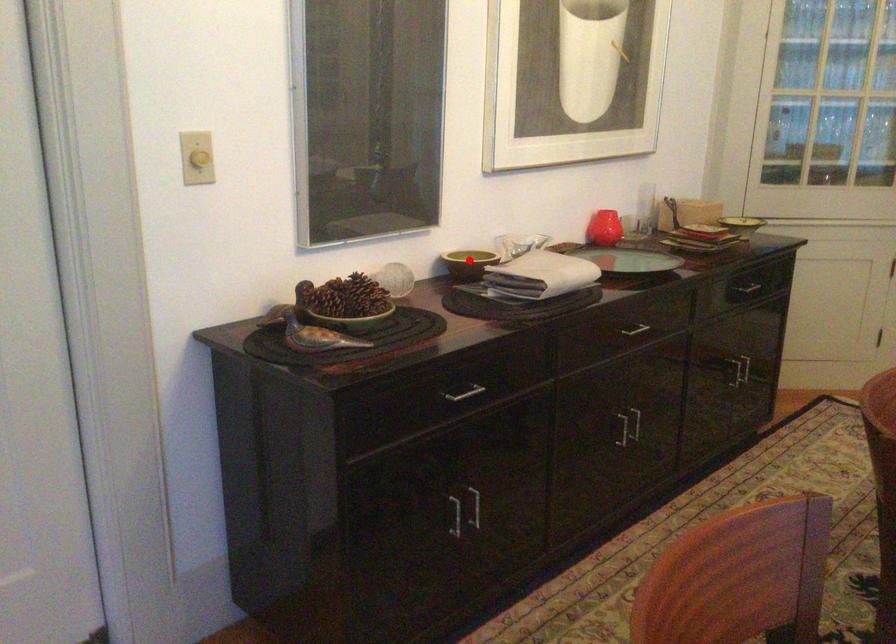
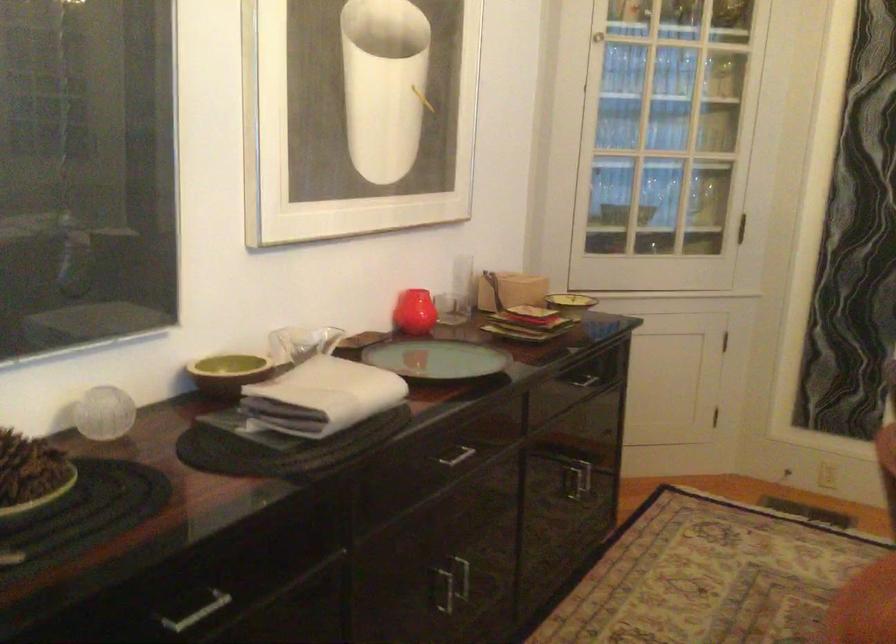
Locate, in the second image, the point that corresponds to the highlighted location in the first image.

(228, 373)